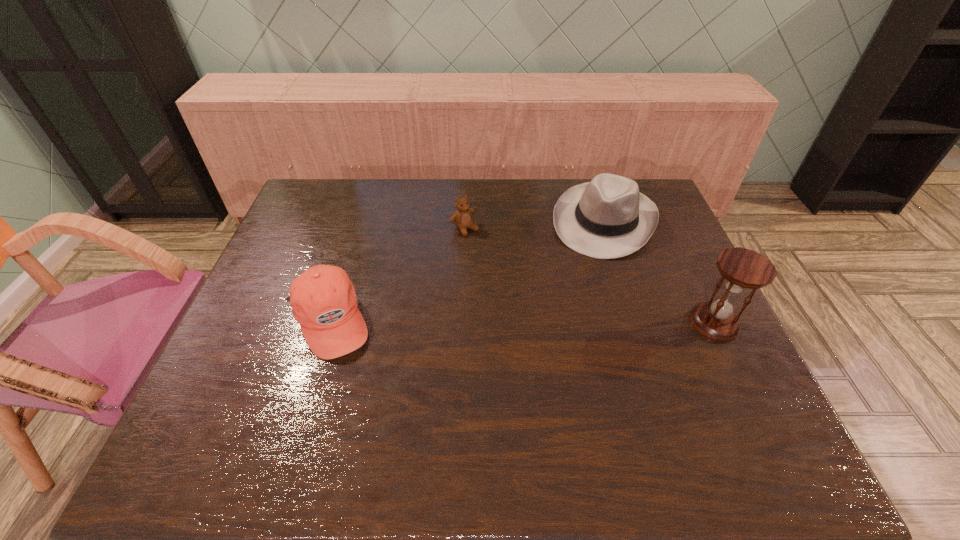
Where is `baseball cap`? The image size is (960, 540). baseball cap is located at coordinates (323, 299).

At what (x,y) coordinates should I click in order to perform the action: click on the tallest object. Please return your answer as a coordinate pair (x, y). The image size is (960, 540). Looking at the image, I should click on 742,269.

Where is `the third object from right to left`? This screenshot has width=960, height=540. the third object from right to left is located at coordinates (462, 218).

Where is `the shortest object`? Image resolution: width=960 pixels, height=540 pixels. the shortest object is located at coordinates (462, 218).

In order to click on fedora in this screenshot , I will do `click(607, 218)`.

Identify the location of vacant space located 0.270m on the front-facing side of the baseball cap. (479, 321).

Where is `blank space located 0.170m on the back of the tallest object`? The height and width of the screenshot is (540, 960). blank space located 0.170m on the back of the tallest object is located at coordinates (684, 261).

Where is `vacant space located on the front-facing side of the teddy bear`? vacant space located on the front-facing side of the teddy bear is located at coordinates (541, 299).

At what (x,y) coordinates should I click in order to perform the action: click on free spot located on the front-facing side of the teddy bear. Please return your answer as a coordinate pair (x, y). Looking at the image, I should click on (498, 260).

Find the location of a particular element. The image size is (960, 540). free space located 0.220m on the front-facing side of the teddy bear is located at coordinates (517, 278).